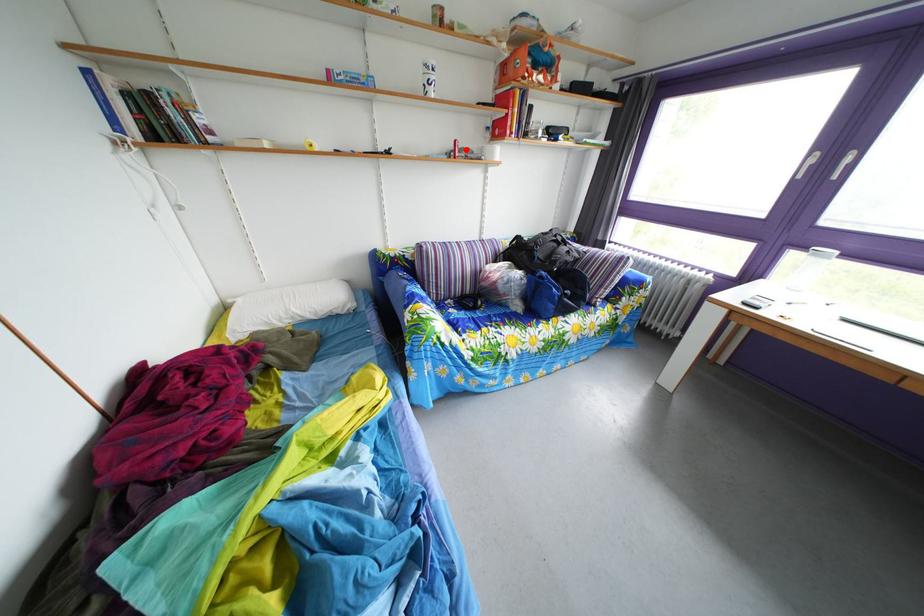
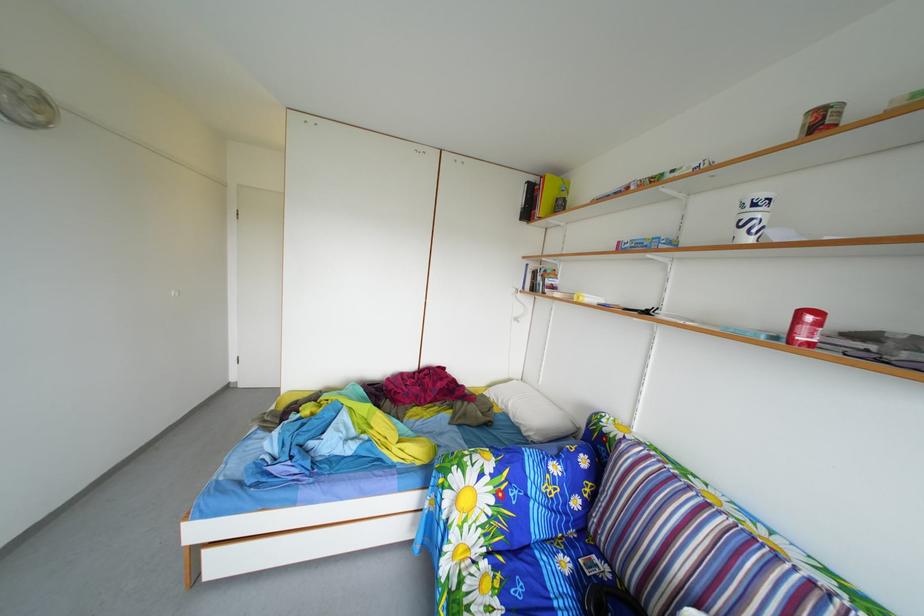
Where in the second image is the point corresponding to the highlighted location from the first image?

(811, 321)